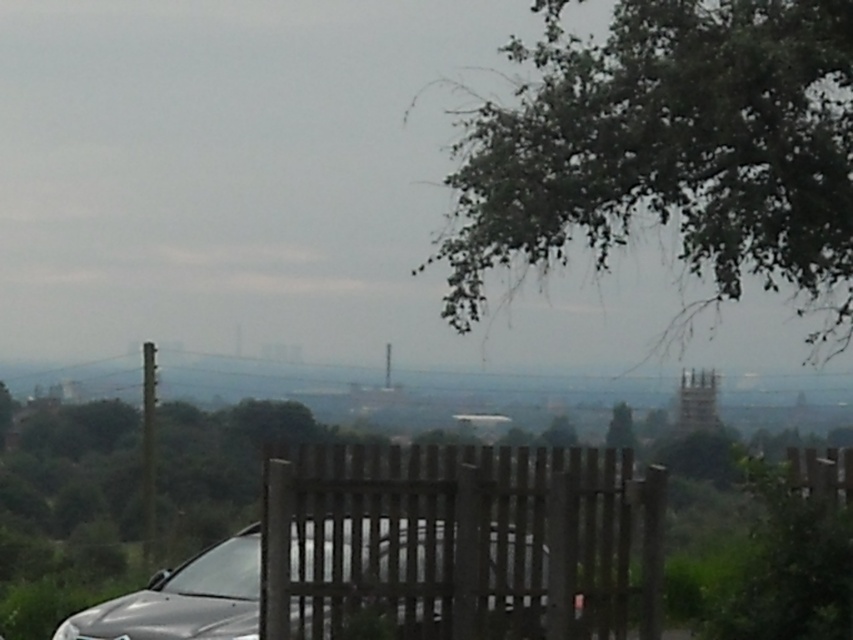
You are a photographer trying to capture a photo of the green leafy tree at center without the satin silver car at center blocking the view. Based on the scene, can you position yourself in a way that the car is entirely out of the frame?

The satin silver car at center is not as tall as the green leafy tree at center, so if you position yourself lower, you can angle the camera upwards to frame the tree while the car is hidden behind the lower part of the tree.

You are standing in the outdoor scene and want to place a small garden gnome exactly at one of the two points, point (x=386, y=486) or point (x=624, y=419). Which point is closer to you so the gnome can be more visible?

Point (x=386, y=486) is closer to the viewer than point (x=624, y=419), so placing the garden gnome there would make it more visible.

You are a landscape architect designing a new park and want to incorporate both the green leafy tree at upper right and the brown wooden fence at center into your design. Based on their sizes, which object should be placed closer to the entrance to ensure visitors notice it first?

The green leafy tree at upper right should be placed closer to the entrance because its width is larger than the brown wooden fence at center, making it more visually prominent.